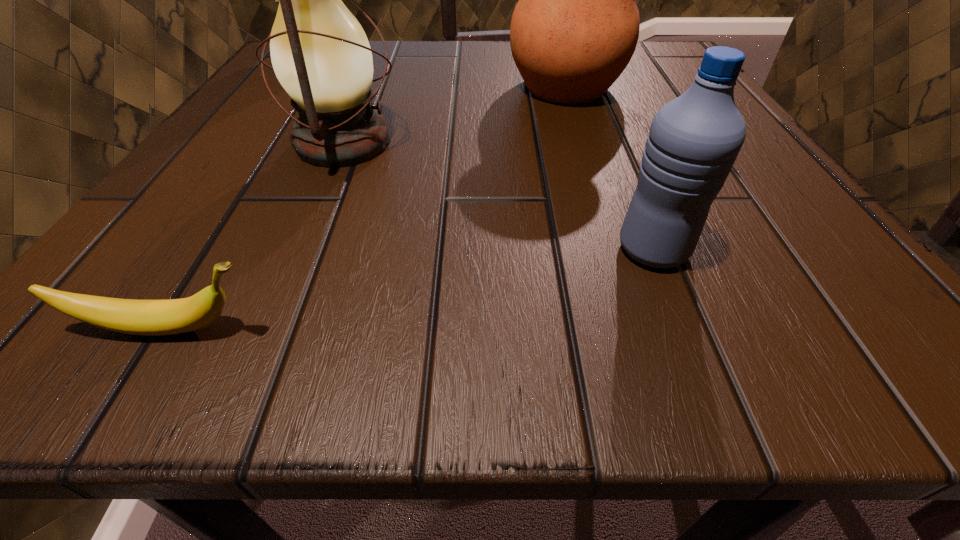
The height and width of the screenshot is (540, 960). In order to click on the tallest object in this screenshot , I will do `click(343, 0)`.

Where is `oil lamp`? oil lamp is located at coordinates (320, 54).

Find the location of a particular element. The width and height of the screenshot is (960, 540). pottery is located at coordinates (575, 28).

Identify the location of water bottle. The width and height of the screenshot is (960, 540). (694, 140).

You are a GUI agent. You are given a task and a screenshot of the screen. Output one action in this format:
    pyautogui.click(x=<x>, y=<y>)
    Task: Click on the nearest object
    This screenshot has width=960, height=540.
    Given the screenshot: What is the action you would take?
    pyautogui.click(x=173, y=316)

What are the coordinates of `banana` in the screenshot? It's located at (173, 316).

Locate an element on the screen. The height and width of the screenshot is (540, 960). vacant space situated on the front-facing side of the tallest object is located at coordinates (288, 106).

You are a GUI agent. You are given a task and a screenshot of the screen. Output one action in this format:
    pyautogui.click(x=<x>, y=<y>)
    Task: Click on the free space located 0.310m on the right of the second tallest object
    
    Given the screenshot: What is the action you would take?
    pos(630,143)

Where is `free region located on the left of the pottery`? Image resolution: width=960 pixels, height=540 pixels. free region located on the left of the pottery is located at coordinates (308, 86).

The image size is (960, 540). Identify the location of vacant space located 0.170m on the back of the fourth farthest object. (612, 146).